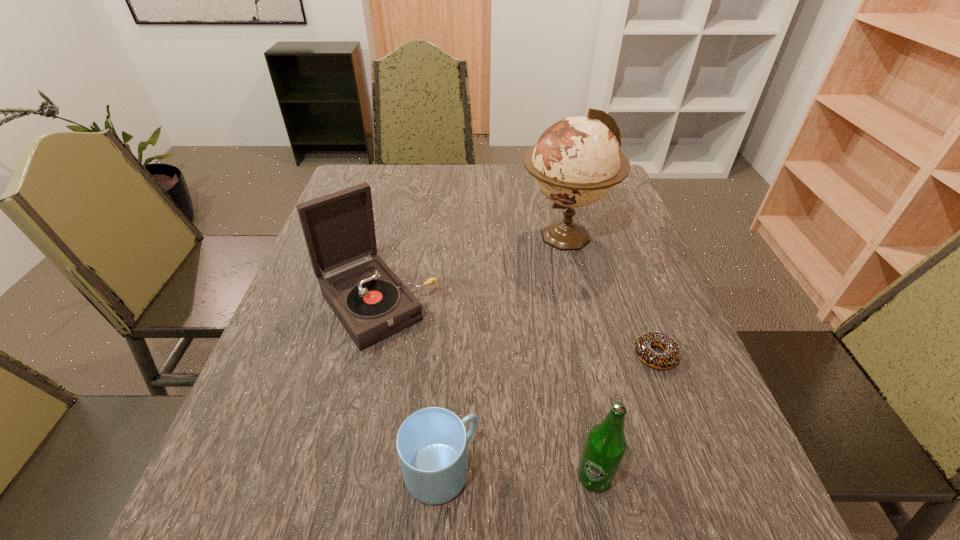
Locate an element on the screen. The image size is (960, 540). free space at the right edge of the desktop is located at coordinates (617, 228).

The width and height of the screenshot is (960, 540). In the image, there is a desktop. Find the location of `free space at the far right corner`. free space at the far right corner is located at coordinates (623, 196).

The height and width of the screenshot is (540, 960). I want to click on vacant point located between the phonograph record and the tallest object, so click(470, 270).

Where is `free spot between the phonograph record and the fourth tallest object`? The image size is (960, 540). free spot between the phonograph record and the fourth tallest object is located at coordinates (409, 388).

Image resolution: width=960 pixels, height=540 pixels. Identify the location of empty space that is in between the globe and the third shortest object. (579, 356).

You are a GUI agent. You are given a task and a screenshot of the screen. Output one action in this format:
    pyautogui.click(x=<x>, y=<y>)
    Task: Click on the free space between the second shortest object and the third shortest object
    This screenshot has width=960, height=540.
    Given the screenshot: What is the action you would take?
    pyautogui.click(x=517, y=474)

This screenshot has height=540, width=960. I want to click on free space between the mug and the third shortest object, so click(x=517, y=474).

Where is `unoccupied area between the shortest object and the second shortest object`? The image size is (960, 540). unoccupied area between the shortest object and the second shortest object is located at coordinates (548, 413).

Locate an element on the screen. The image size is (960, 540). unoccupied area between the beer bottle and the mug is located at coordinates (517, 474).

The width and height of the screenshot is (960, 540). Find the location of `free spot between the tallest object and the phonograph record`. free spot between the tallest object and the phonograph record is located at coordinates (470, 270).